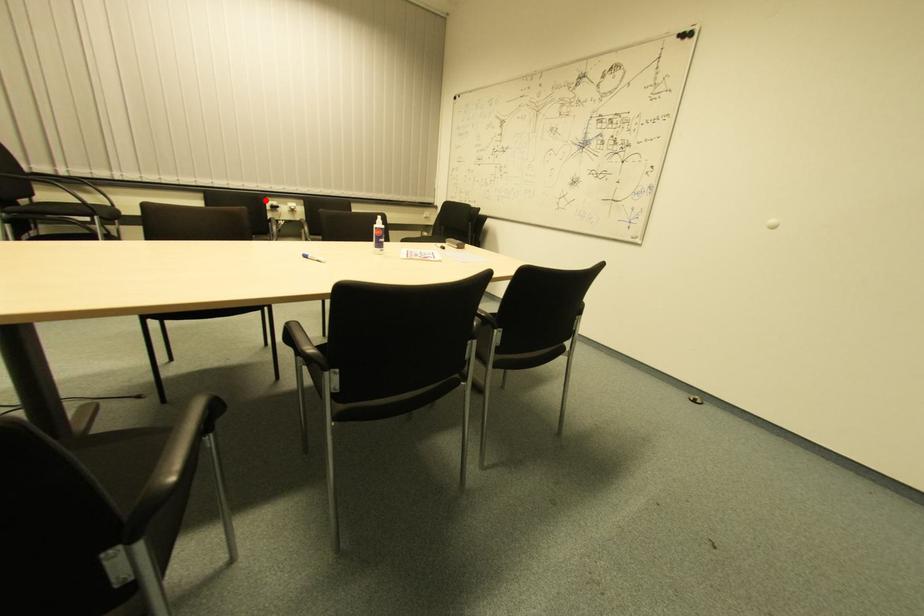
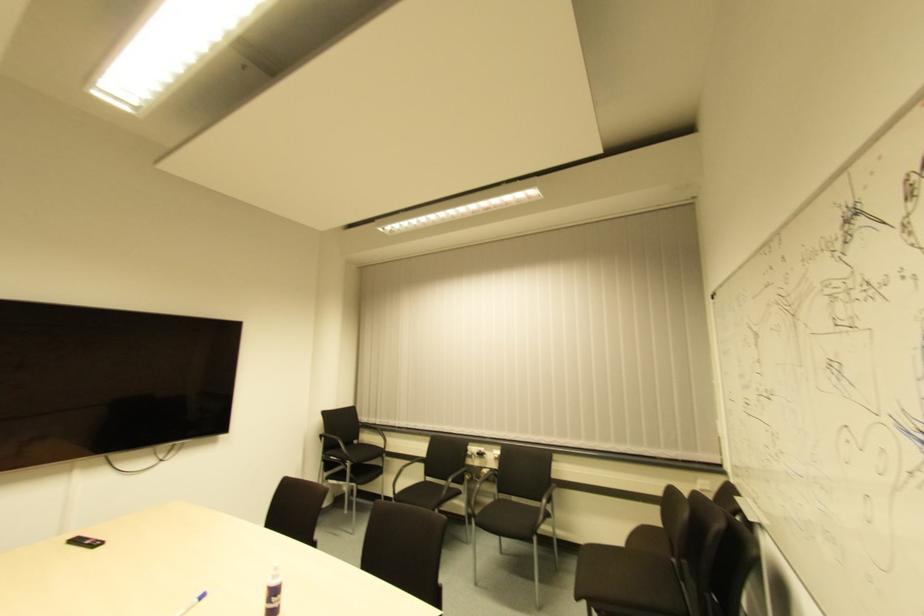
The point at the highlighted location is marked in the first image. Where is the corresponding point in the second image?

(468, 447)